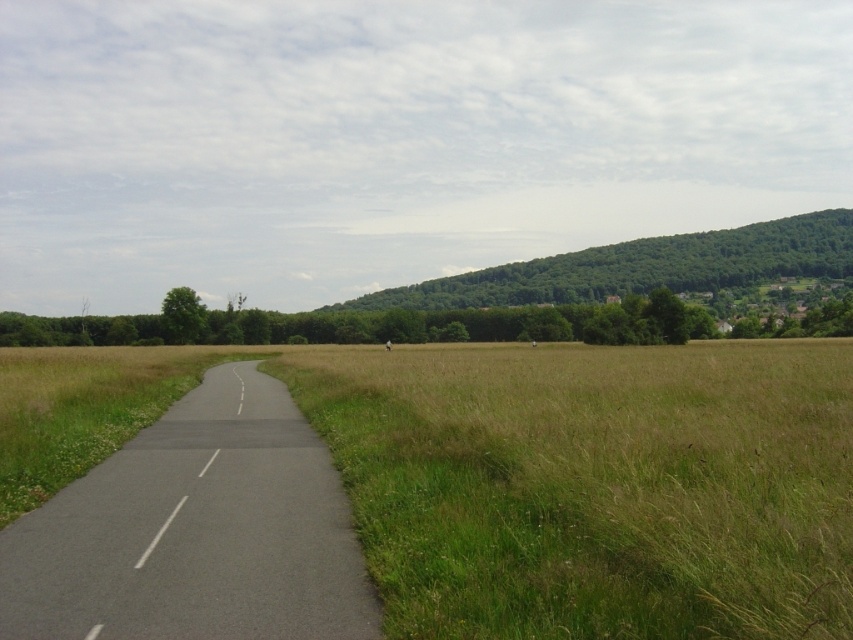
Can you confirm if green grass at center is positioned below asphalt road at center?

Actually, green grass at center is above asphalt road at center.

Is green grass at center smaller than asphalt road at center?

No.

Does point (309, 403) lie in front of point (61, 628)?

That is False.

Where is `green grass at center`? The width and height of the screenshot is (853, 640). green grass at center is located at coordinates (595, 484).

Between green grass at center and green leafy hill at upper right, which one appears on the right side from the viewer's perspective?

green leafy hill at upper right

From the picture: Who is shorter, green grass at center or green leafy hill at upper right?

With less height is green grass at center.

Between point (409, 422) and point (331, 305), which one is positioned in front?

Point (409, 422) is more forward.

Find the location of `green grass at center`. green grass at center is located at coordinates (595, 484).

Is asphalt road at center wider than green leafy hill at upper right?

No, asphalt road at center is not wider than green leafy hill at upper right.

Is asphalt road at center taller than green leafy hill at upper right?

In fact, asphalt road at center may be shorter than green leafy hill at upper right.

Where is `asphalt road at center`? This screenshot has width=853, height=640. asphalt road at center is located at coordinates (195, 531).